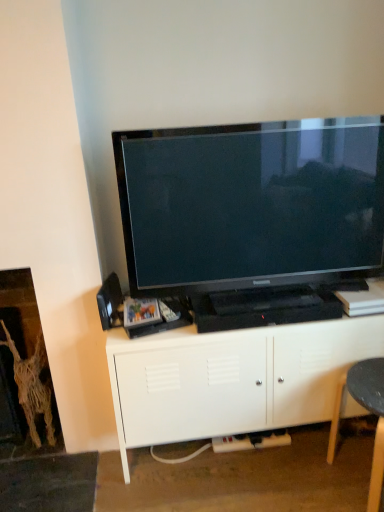
Question: From the image's perspective, is black plastic plug at lower center above matte black tv at center?

Choices:
 (A) no
 (B) yes

Answer: (A)

Question: Considering the relative positions of black plastic plug at lower center and matte black tv at center in the image provided, is black plastic plug at lower center behind matte black tv at center?

Choices:
 (A) yes
 (B) no

Answer: (A)

Question: Is black plastic plug at lower center to the left of matte black tv at center from the viewer's perspective?

Choices:
 (A) yes
 (B) no

Answer: (A)

Question: From a real-world perspective, is black plastic plug at lower center positioned under matte black tv at center based on gravity?

Choices:
 (A) yes
 (B) no

Answer: (A)

Question: Could you tell me if black plastic plug at lower center is turned towards matte black tv at center?

Choices:
 (A) no
 (B) yes

Answer: (A)

Question: From the image's perspective, is black plastic swivel chair at lower right located above or below white matte cabinet at center?

Choices:
 (A) below
 (B) above

Answer: (A)

Question: Looking at their shapes, would you say black plastic swivel chair at lower right is wider or thinner than white matte cabinet at center?

Choices:
 (A) wide
 (B) thin

Answer: (B)

Question: From a real-world perspective, is black plastic swivel chair at lower right above or below white matte cabinet at center?

Choices:
 (A) above
 (B) below

Answer: (B)

Question: Considering the positions of black plastic swivel chair at lower right and white matte cabinet at center in the image, is black plastic swivel chair at lower right bigger or smaller than white matte cabinet at center?

Choices:
 (A) small
 (B) big

Answer: (A)

Question: Considering the positions of brown woven fireplace at left and matte black tv at center in the image, is brown woven fireplace at left bigger or smaller than matte black tv at center?

Choices:
 (A) big
 (B) small

Answer: (B)

Question: From a real-world perspective, relative to matte black tv at center, is brown woven fireplace at left vertically above or below?

Choices:
 (A) above
 (B) below

Answer: (B)

Question: Looking at their shapes, would you say brown woven fireplace at left is wider or thinner than matte black tv at center?

Choices:
 (A) thin
 (B) wide

Answer: (B)

Question: Is brown woven fireplace at left in front of or behind matte black tv at center in the image?

Choices:
 (A) behind
 (B) front

Answer: (A)

Question: Is matte black tv at center wider or thinner than black plastic plug at lower center?

Choices:
 (A) wide
 (B) thin

Answer: (A)

Question: Considering the positions of matte black tv at center and black plastic plug at lower center in the image, is matte black tv at center bigger or smaller than black plastic plug at lower center?

Choices:
 (A) big
 (B) small

Answer: (A)